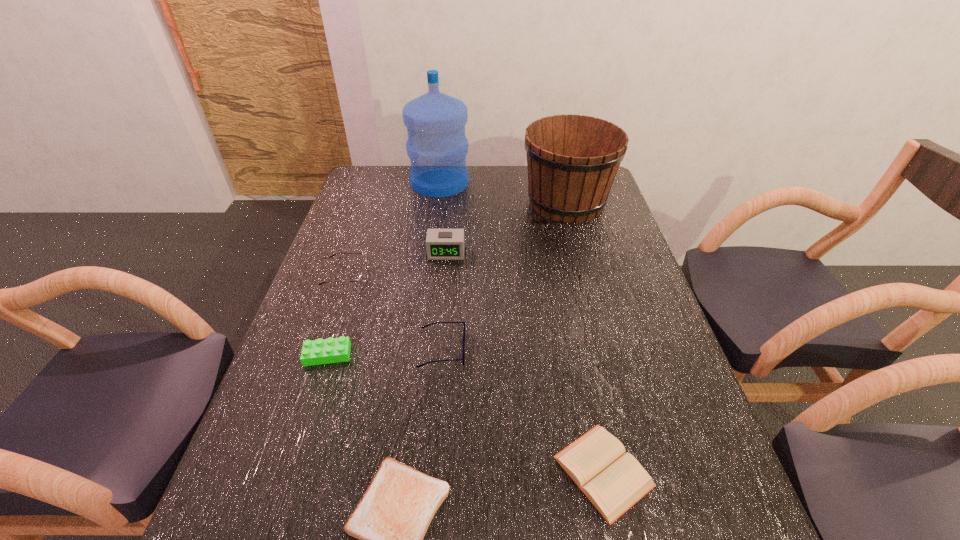
At what (x,y) coordinates should I click in order to perform the action: click on wine bucket that is at the right edge. Please return your answer as a coordinate pair (x, y). Image resolution: width=960 pixels, height=540 pixels. Looking at the image, I should click on (572, 160).

The image size is (960, 540). Identify the location of diary located in the right edge section of the desktop. (613, 481).

Where is `object positioned at the far right corner`? The width and height of the screenshot is (960, 540). object positioned at the far right corner is located at coordinates (572, 160).

This screenshot has height=540, width=960. Find the location of `vacant space at the far edge of the desktop`. vacant space at the far edge of the desktop is located at coordinates (463, 194).

The image size is (960, 540). In order to click on free space at the left edge of the desktop in this screenshot , I will do `click(262, 429)`.

The height and width of the screenshot is (540, 960). Find the location of `vacant space at the right edge of the desktop`. vacant space at the right edge of the desktop is located at coordinates [x=593, y=228].

In the image, there is a desktop. Find the location of `free space at the far left corner`. free space at the far left corner is located at coordinates (358, 191).

Find the location of a particular element. This screenshot has height=540, width=960. free space between the tallest object and the Lego is located at coordinates (384, 269).

Identify the location of unoccupied position between the left spectacles and the Lego. (337, 315).

Locate an element on the screen. Image resolution: width=960 pixels, height=540 pixels. unoccupied position between the second tallest object and the second shortest object is located at coordinates (585, 336).